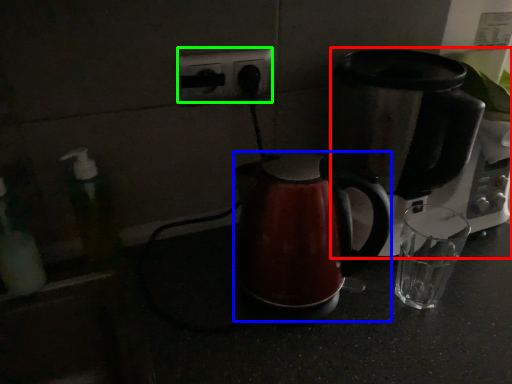
Question: Estimate the real-world distances between objects in this image. Which object is closer to coffee maker (highlighted by a red box), kettle (highlighted by a blue box) or electric outlet (highlighted by a green box)?

Choices:
 (A) kettle
 (B) electric outlet

Answer: (A)